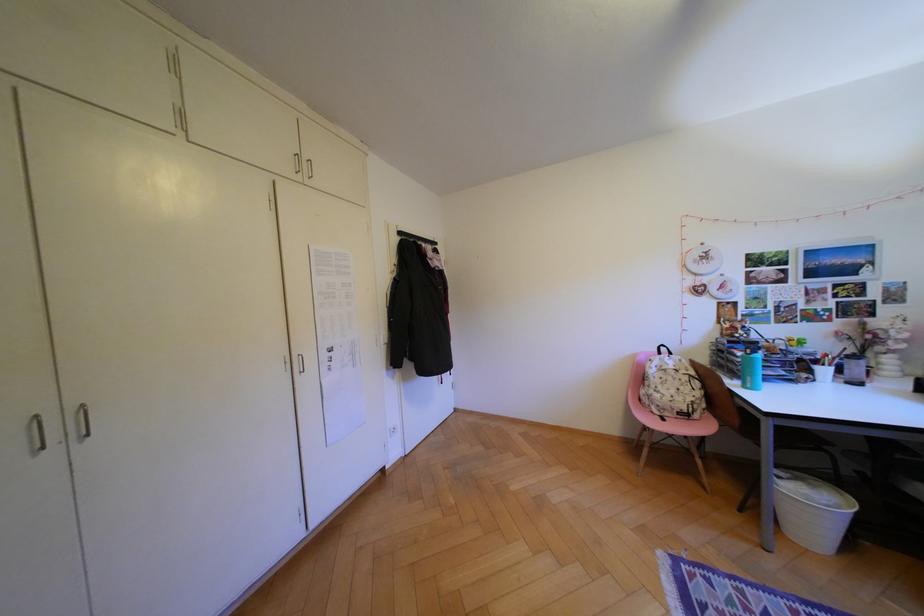
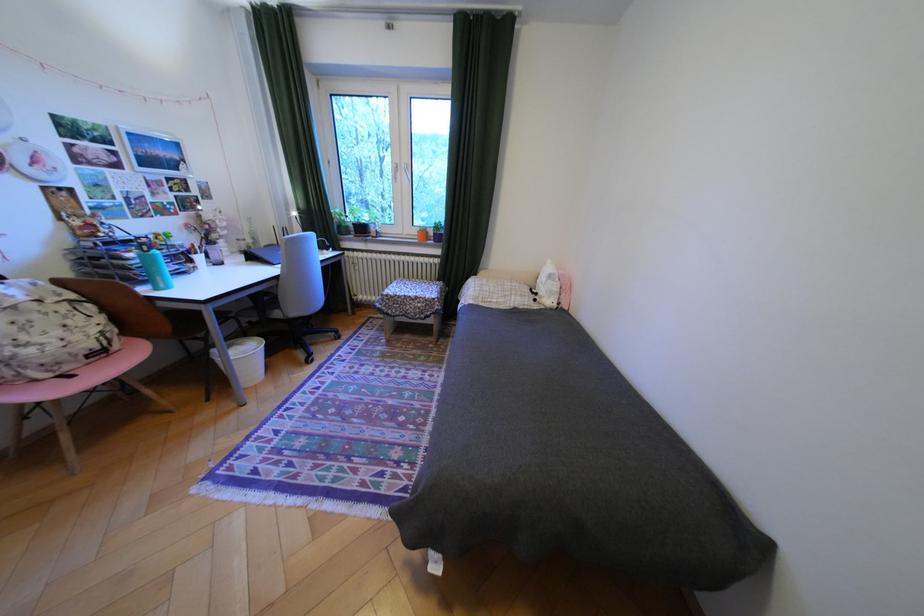
The point at (821, 485) is marked in the first image. Where is the corresponding point in the second image?

(249, 345)